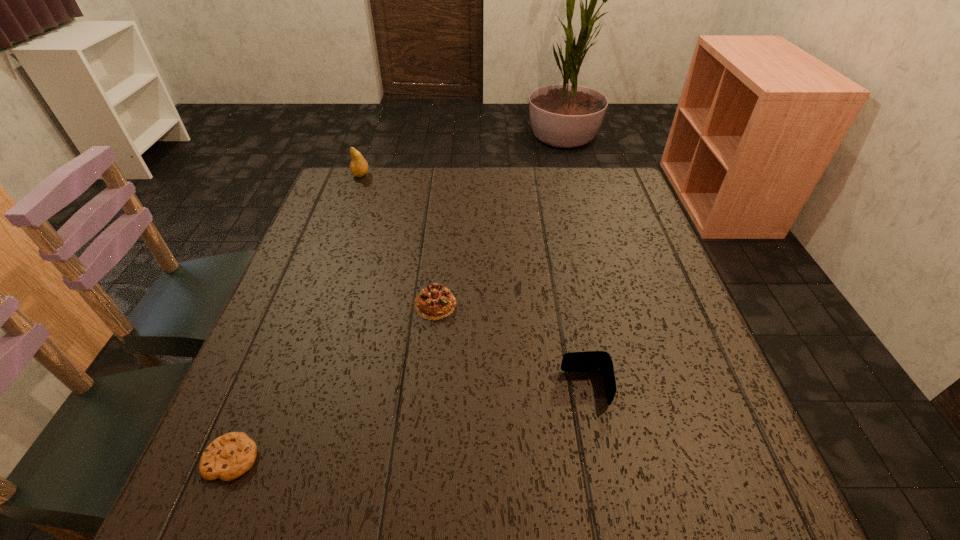
Find the location of a particular element. The image size is (960, 540). the farthest object is located at coordinates (359, 167).

You are a GUI agent. You are given a task and a screenshot of the screen. Output one action in this format:
    pyautogui.click(x=<x>, y=<y>)
    Task: Click on the tallest object
    This screenshot has width=960, height=540.
    Given the screenshot: What is the action you would take?
    pyautogui.click(x=359, y=167)

What are the coordinates of `the third farthest object` in the screenshot? It's located at (591, 361).

You are a GUI agent. You are given a task and a screenshot of the screen. Output one action in this format:
    pyautogui.click(x=<x>, y=<y>)
    Task: Click on the second tallest object
    
    Given the screenshot: What is the action you would take?
    pyautogui.click(x=591, y=361)

I want to click on the second farthest object, so click(435, 302).

You are a GUI agent. You are given a task and a screenshot of the screen. Output one action in this format:
    pyautogui.click(x=<x>, y=<y>)
    Task: Click on the second object from right to left
    The width and height of the screenshot is (960, 540).
    Given the screenshot: What is the action you would take?
    pyautogui.click(x=435, y=302)

The height and width of the screenshot is (540, 960). Identify the location of the shortest object. (229, 456).

Where is `cookie`? cookie is located at coordinates (229, 456).

You are a GUI agent. You are given a task and a screenshot of the screen. Output one action in this format:
    pyautogui.click(x=<x>, y=<y>)
    Task: Click on the vacant position located on the front of the pear
    This screenshot has width=960, height=540.
    Given the screenshot: What is the action you would take?
    pyautogui.click(x=326, y=268)

Locate an element on the screen. The image size is (960, 540). free point located 0.100m on the outer surface of the second nearest object is located at coordinates (508, 388).